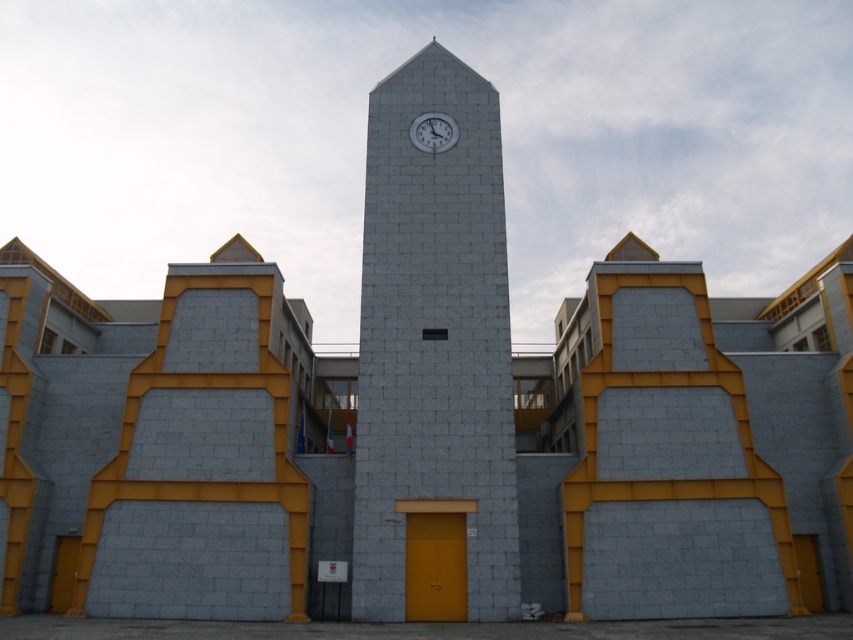
Question: Does gray stone clock tower at center have a smaller size compared to white glossy clock at upper center?

Choices:
 (A) yes
 (B) no

Answer: (B)

Question: Does gray stone clock tower at center lie in front of white glossy clock at upper center?

Choices:
 (A) no
 (B) yes

Answer: (B)

Question: Among these objects, which one is farthest from the camera?

Choices:
 (A) white glossy clock at upper center
 (B) gray stone clock tower at center

Answer: (A)

Question: Does gray stone clock tower at center have a larger size compared to white glossy clock at upper center?

Choices:
 (A) no
 (B) yes

Answer: (B)

Question: Which point appears farthest from the camera in this image?

Choices:
 (A) (468, 602)
 (B) (416, 124)

Answer: (B)

Question: Which point is closer to the camera taking this photo?

Choices:
 (A) (405, 97)
 (B) (419, 115)

Answer: (B)